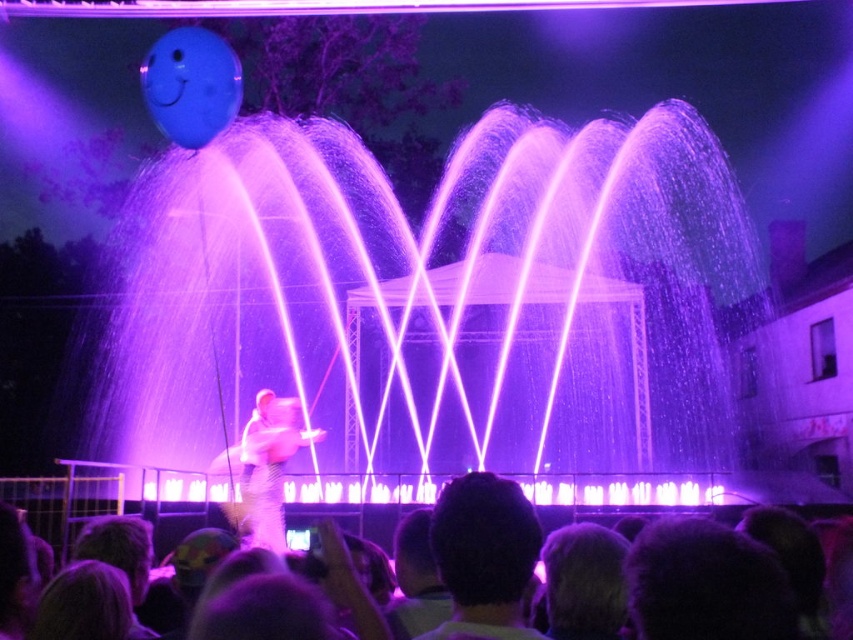
You are a stagehand at the event and need to ensure safety. The purple translucent water at center is part of the fountain system, and the silky hair at lower center belongs to a performer. Given the distance between them, can you confirm if the performer is within the recommended safety zone of 30 meters from the fountain?

The distance between the purple translucent water at center and the silky hair at lower center is 28.71 meters, which is within the recommended safety zone of 30 meters. The performer is safely positioned within the required distance.

From the picture: You are a photographer at the event and want to capture a clear photo of the white fluffy costume at center without the silky hair at lower center blocking it. What adjustment should you make to your camera position?

Move your camera position backward to create more distance between the silky hair at lower center and the white fluffy costume at center. Since the silky hair at lower center is in front of the white fluffy costume at center, moving back will help reduce the overlap and allow the costume to be visible clearly.

You are standing at the edge of the stage in the nighttime festival scene. You notice a point marked at coordinates (x=442, y=298). What object does this point correspond to?

The point at coordinates (x=442, y=298) corresponds to the purple translucent water at center.